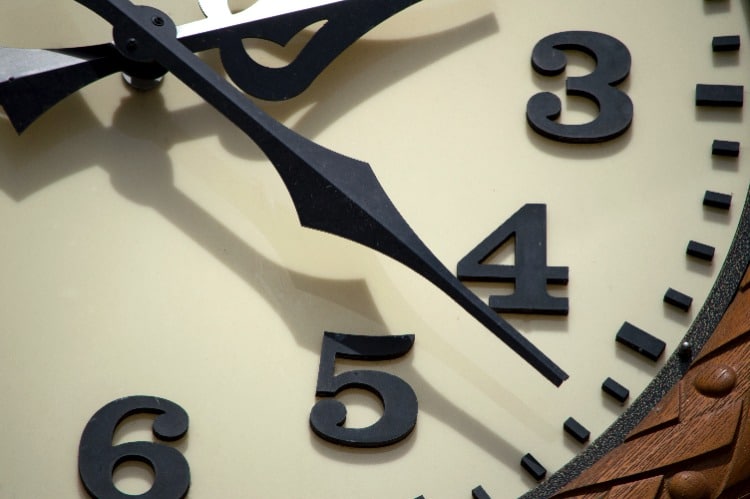
Find the location of a particular element. clock numbers 3-6 is located at coordinates (x=598, y=98), (x=541, y=270), (x=391, y=386), (x=153, y=464).